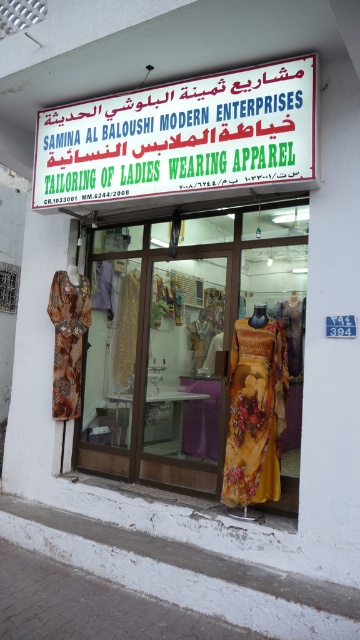
Question: Is floral fabric dress at center thinner than white plastic sign at upper center?

Choices:
 (A) no
 (B) yes

Answer: (B)

Question: Which object appears closest to the camera in this image?

Choices:
 (A) floral fabric dress at center
 (B) floral silk dress at center

Answer: (B)

Question: Which of the following is the closest to the observer?

Choices:
 (A) white plastic sign at upper center
 (B) floral silk dress at center

Answer: (A)

Question: Can you confirm if white plastic sign at upper center is positioned above floral silk dress at left?

Choices:
 (A) no
 (B) yes

Answer: (B)

Question: Which of these objects is positioned farthest from the floral silk dress at center?

Choices:
 (A) white plastic sign at upper center
 (B) floral silk dress at left

Answer: (B)

Question: Can you confirm if floral fabric dress at center is positioned to the right of floral silk dress at left?

Choices:
 (A) no
 (B) yes

Answer: (B)